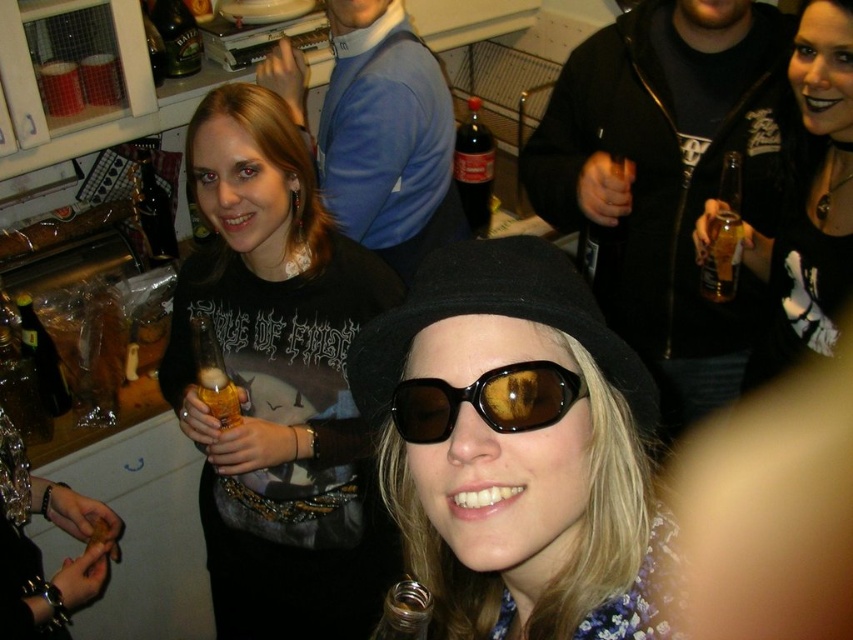
Is point (297, 465) closer to camera compared to point (605, 236)?

That is True.

Does point (335, 477) come behind point (621, 244)?

That is False.

Measure the distance between matte black shirt at center and camera.

matte black shirt at center is 1.19 meters from camera.

I want to click on matte black shirt at center, so click(x=277, y=384).

From the picture: Between translucent glass bottle at left and green glass bottle at upper left, which one has more height?

translucent glass bottle at left is taller.

Is point (25, 301) behind point (193, 19)?

No, (25, 301) is closer to viewer.

Where is `translucent glass bottle at left`? translucent glass bottle at left is located at coordinates (42, 356).

Between point (329, 458) and point (480, 228), which one is positioned in front?

Point (329, 458)

Is matte black shirt at center above dark glass coca-cola at center?

No, matte black shirt at center is not above dark glass coca-cola at center.

Is point (253, 344) positioned behind point (485, 160)?

No, (253, 344) is closer to viewer.

At what (x,y) coordinates should I click in order to perform the action: click on matte black shirt at center. Please return your answer as a coordinate pair (x, y). The width and height of the screenshot is (853, 640). Looking at the image, I should click on (277, 384).